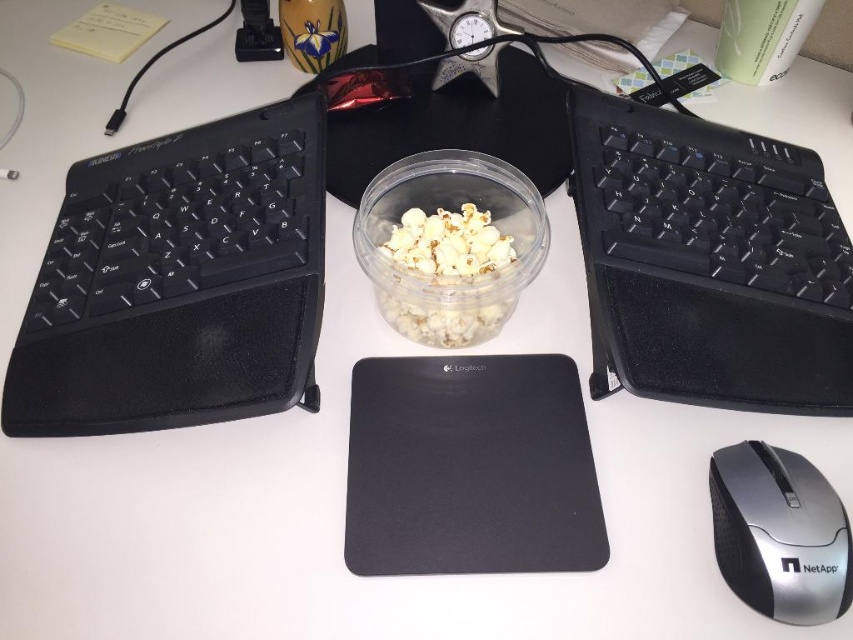
Question: Is silver/black plastic mouse at lower right to the right of white matte popcorn at center from the viewer's perspective?

Choices:
 (A) yes
 (B) no

Answer: (A)

Question: Which object is closer to the camera taking this photo?

Choices:
 (A) black matte keyboard at right
 (B) silver/black plastic mouse at lower right

Answer: (B)

Question: Which point appears closest to the camera in this image?

Choices:
 (A) (735, 288)
 (B) (776, 499)
 (C) (108, 403)
 (D) (469, 248)

Answer: (B)

Question: Among these points, which one is nearest to the camera?

Choices:
 (A) (635, 360)
 (B) (76, 385)
 (C) (448, 298)

Answer: (C)

Question: Is silver/black plastic mouse at lower right wider than white matte popcorn at center?

Choices:
 (A) yes
 (B) no

Answer: (B)

Question: In this image, where is black matte keyboard at right located relative to silver/black plastic mouse at lower right?

Choices:
 (A) right
 (B) left

Answer: (A)